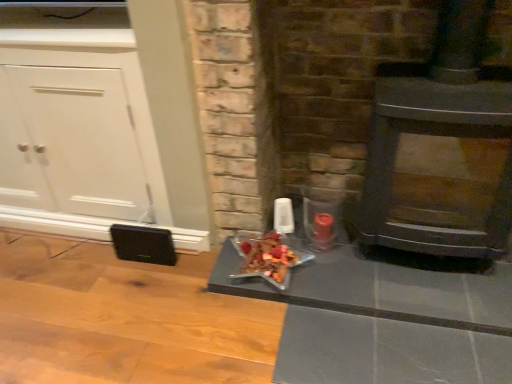
Question: Relative to matte black fireplace at center, is white matte cabinet at left in front or behind?

Choices:
 (A) behind
 (B) front

Answer: (A)

Question: In terms of size, does white matte cabinet at left appear bigger or smaller than matte black fireplace at center?

Choices:
 (A) small
 (B) big

Answer: (A)

Question: Which of these objects is positioned farthest from the shiny metallic star at center?

Choices:
 (A) matte black fireplace at center
 (B) wooden panel stove at right
 (C) shiny glass tray at center
 (D) white matte cabinet at left

Answer: (D)

Question: Which object is positioned closest to the shiny glass tray at center?

Choices:
 (A) shiny metallic star at center
 (B) wooden panel stove at right
 (C) white matte cabinet at left
 (D) matte black fireplace at center

Answer: (D)